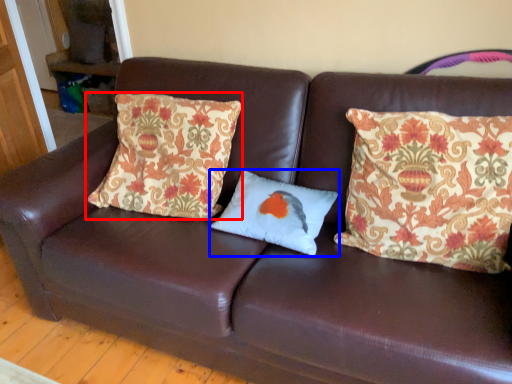
Question: Which object is closer to the camera taking this photo, pillow (highlighted by a red box) or pillow (highlighted by a blue box)?

Choices:
 (A) pillow
 (B) pillow

Answer: (A)